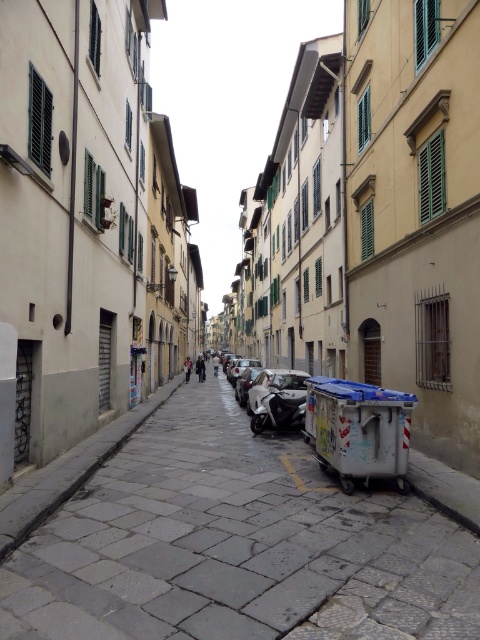
Who is higher up, gray stone pavement at center or silver metallic car at center?

Positioned higher is gray stone pavement at center.

Is gray stone pavement at center above silver metallic car at center?

Correct, gray stone pavement at center is located above silver metallic car at center.

Find the location of a particular element. The height and width of the screenshot is (640, 480). gray stone pavement at center is located at coordinates (236, 545).

The height and width of the screenshot is (640, 480). I want to click on gray stone pavement at center, so point(236,545).

The height and width of the screenshot is (640, 480). Describe the element at coordinates (236, 545) in the screenshot. I see `gray stone pavement at center` at that location.

Is point (467, 604) closer to camera compared to point (232, 378)?

Yes, point (467, 604) is in front of point (232, 378).

Does point (253, 556) lie in front of point (229, 372)?

Yes, it is in front of point (229, 372).

At what (x,y) coordinates should I click in order to perform the action: click on gray stone pavement at center. Please return your answer as a coordinate pair (x, y). The image size is (480, 640). Looking at the image, I should click on (236, 545).

Between gray stone pavement at center and shiny silver motorcycle at center, which one has more height?

Standing taller between the two is shiny silver motorcycle at center.

Does gray stone pavement at center have a larger size compared to shiny silver motorcycle at center?

Yes.

Is point (36, 547) in front of point (256, 429)?

Yes, it is in front of point (256, 429).

I want to click on gray stone pavement at center, so click(236, 545).